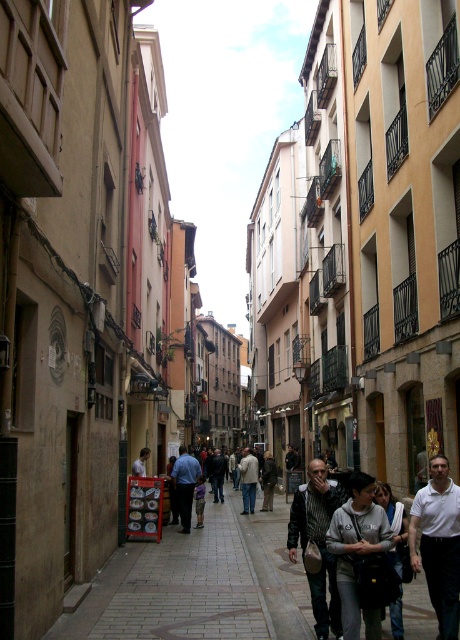
You are standing at the entrance of a shop on the street and notice a dark brown leather jacket at center. If you want to move towards it, in which direction should you walk?

The dark brown leather jacket at center is located at point (317, 541), so you should walk forward towards the center of the street to reach it.

You are a street vendor trying to place a 0.5 meters wide sign between the white matte shirt at lower right and the light gray jacket at center. Can the sign fit between them?

The white matte shirt at lower right is narrower than the light gray jacket at center. However, the exact distance between them isn

You are a street performer planning to set up a booth in the lively European street scene. You notice a white matte shirt at lower right and a light gray jacket at center. Which of these two people is closer to you, the observer?

The white matte shirt at lower right is closer to you because it is in front of the light gray jacket at center.